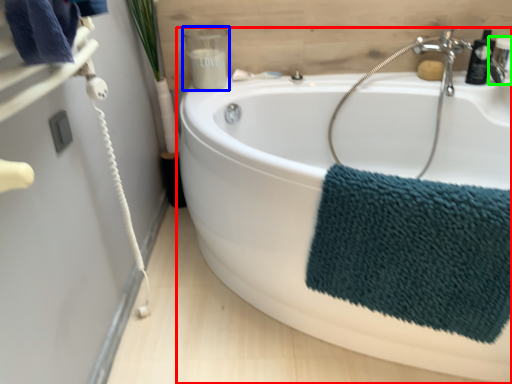
Question: Estimate the real-world distances between objects in this image. Which object is closer to bathtub (highlighted by a red box), toiletry (highlighted by a blue box) or plumbing fixture (highlighted by a green box)?

Choices:
 (A) toiletry
 (B) plumbing fixture

Answer: (A)